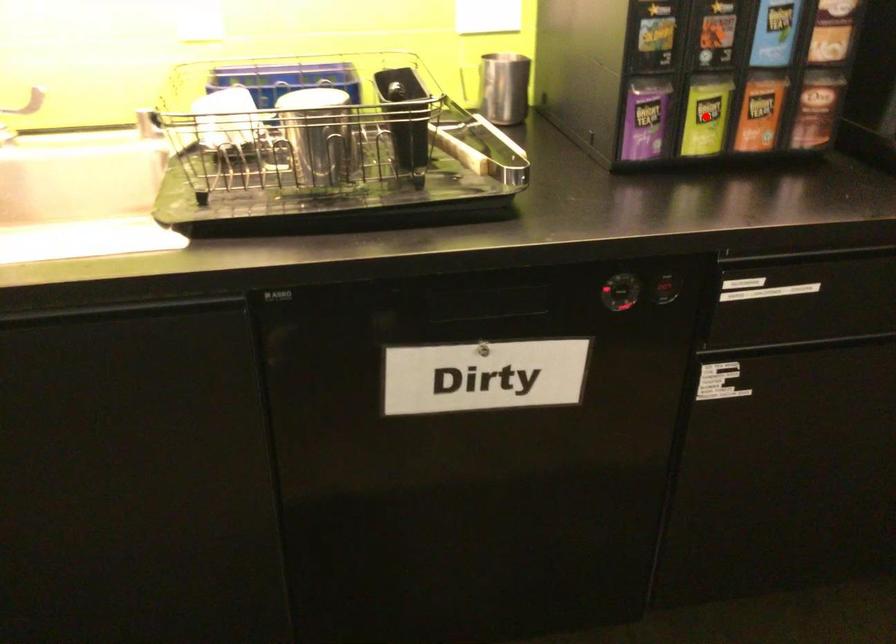
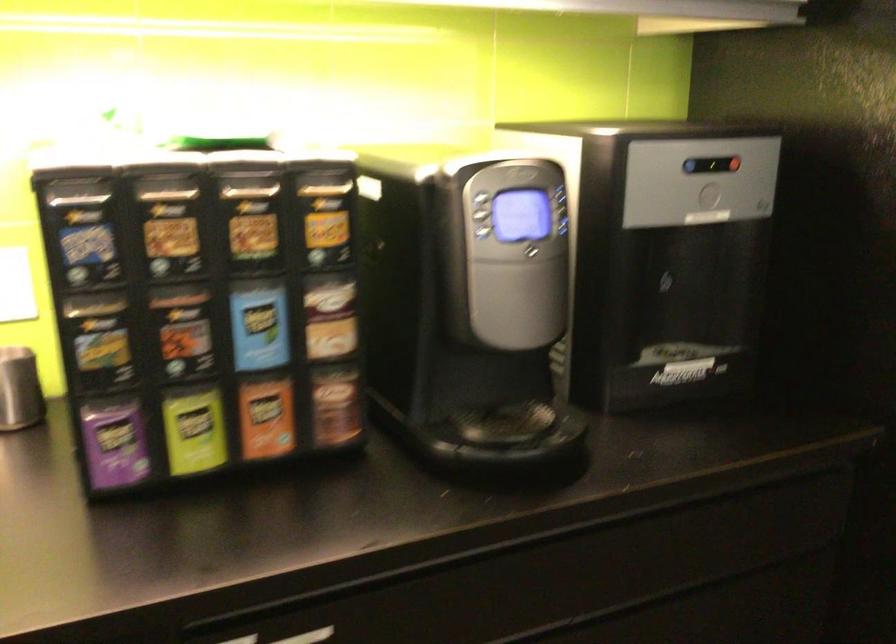
Question: I am providing you with two images of the same scene from different viewpoints. In image1, a red point is highlighted. Considering the same 3D point in image2, which of the following is correct?

Choices:
 (A) It is closer
 (B) It is farther

Answer: (A)